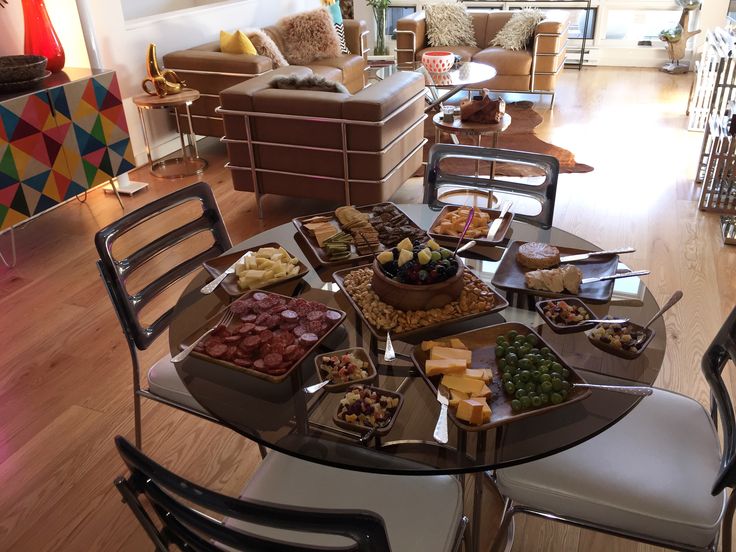
Identify the location of plant. (378, 25).